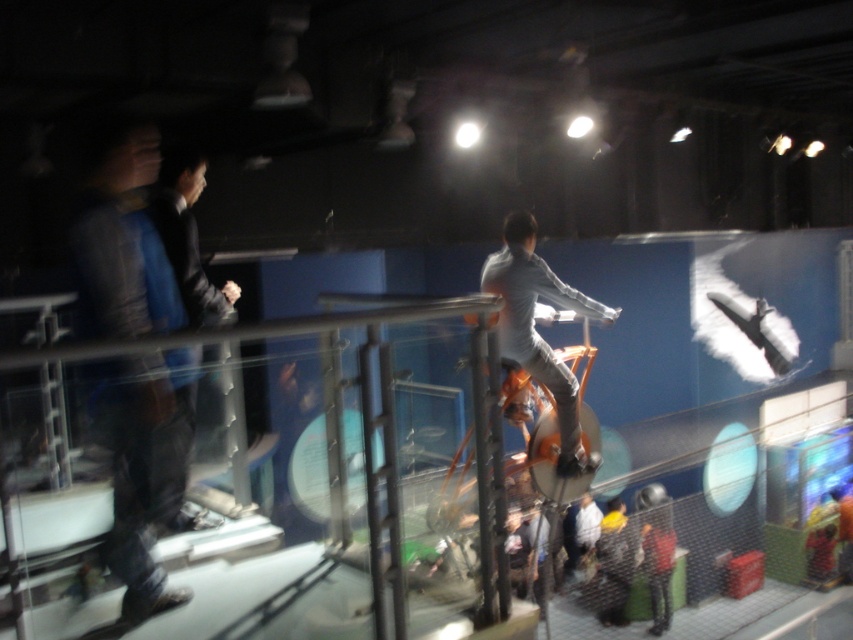
Is light gray fabric shirt at center taller than dark blue suit at left?

Indeed, light gray fabric shirt at center has a greater height compared to dark blue suit at left.

Between light gray fabric shirt at center and dark blue suit at left, which one has more height?

Standing taller between the two is light gray fabric shirt at center.

This screenshot has height=640, width=853. In order to click on light gray fabric shirt at center in this screenshot , I will do `click(537, 332)`.

Does dark blue suit at left have a lesser width compared to red fabric jacket at lower right?

Yes, dark blue suit at left is thinner than red fabric jacket at lower right.

From the picture: Does dark blue suit at left appear on the right side of red fabric jacket at lower right?

Incorrect, dark blue suit at left is not on the right side of red fabric jacket at lower right.

Between point (184, 244) and point (648, 500), which one is positioned behind?

The point (648, 500) is behind.

Locate an element on the screen. This screenshot has width=853, height=640. dark blue suit at left is located at coordinates (187, 236).

Which of these two, light gray fabric shirt at center or red fabric jacket at lower right, stands taller?

light gray fabric shirt at center is taller.

Is light gray fabric shirt at center taller than red fabric jacket at lower right?

Correct, light gray fabric shirt at center is much taller as red fabric jacket at lower right.

Image resolution: width=853 pixels, height=640 pixels. What do you see at coordinates (537, 332) in the screenshot?
I see `light gray fabric shirt at center` at bounding box center [537, 332].

Locate an element on the screen. light gray fabric shirt at center is located at coordinates (537, 332).